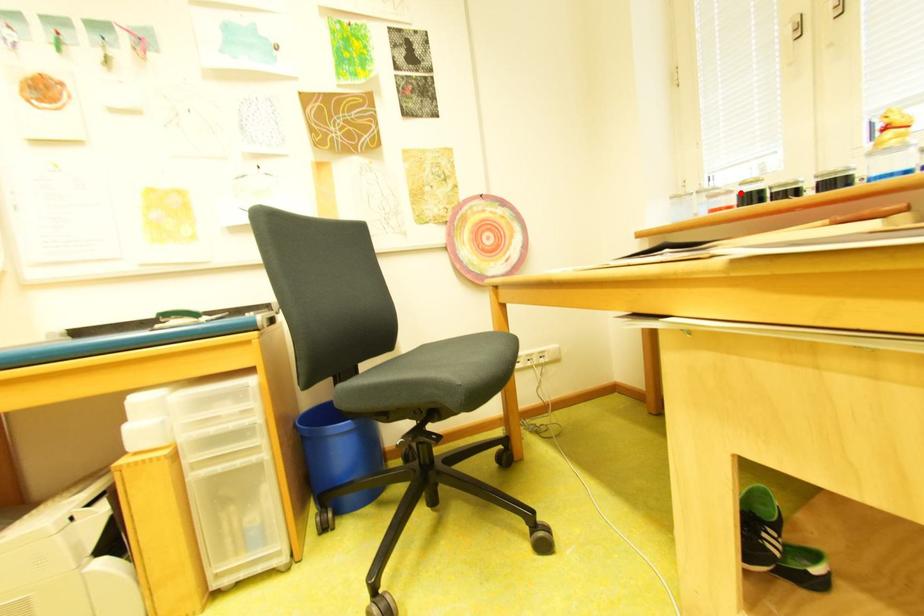
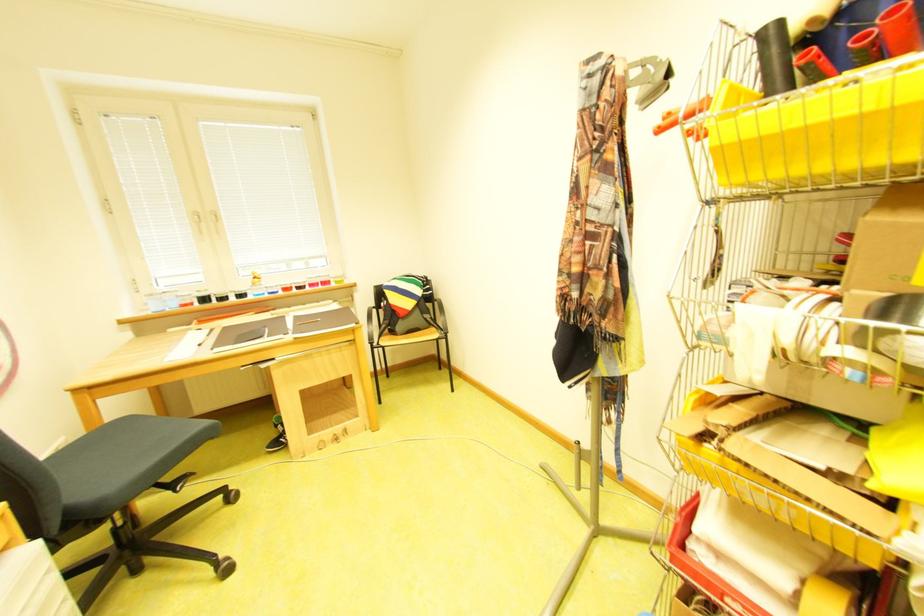
In the second image, find the point that corresponds to the highlighted location in the first image.

(201, 296)